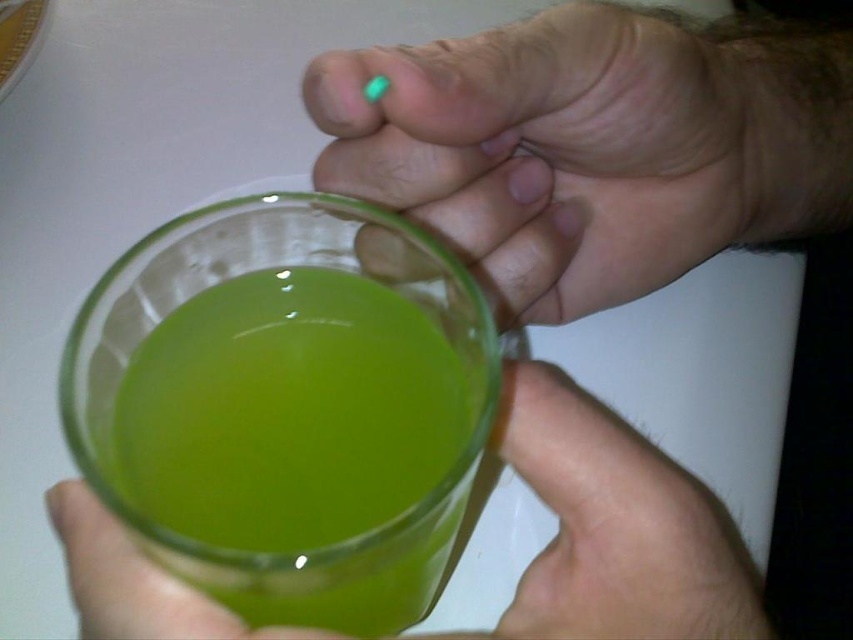
Question: Among these points, which one is farthest from the camera?

Choices:
 (A) (616, 616)
 (B) (421, 454)

Answer: (B)

Question: Is green translucent liquid at center smaller than transparent glass cup at center?

Choices:
 (A) yes
 (B) no

Answer: (A)

Question: From the image, what is the correct spatial relationship of matte green glass at upper center in relation to transparent glass cup at center?

Choices:
 (A) right
 (B) left

Answer: (A)

Question: Which point is farther to the camera?

Choices:
 (A) (409, 486)
 (B) (554, 74)
 (C) (641, 467)

Answer: (B)

Question: Can you confirm if matte green glass at upper center is positioned to the right of transparent glass cup at center?

Choices:
 (A) yes
 (B) no

Answer: (A)

Question: Which object is positioned closest to the matte green glass at upper center?

Choices:
 (A) green translucent liquid at center
 (B) transparent glass cup at center

Answer: (B)